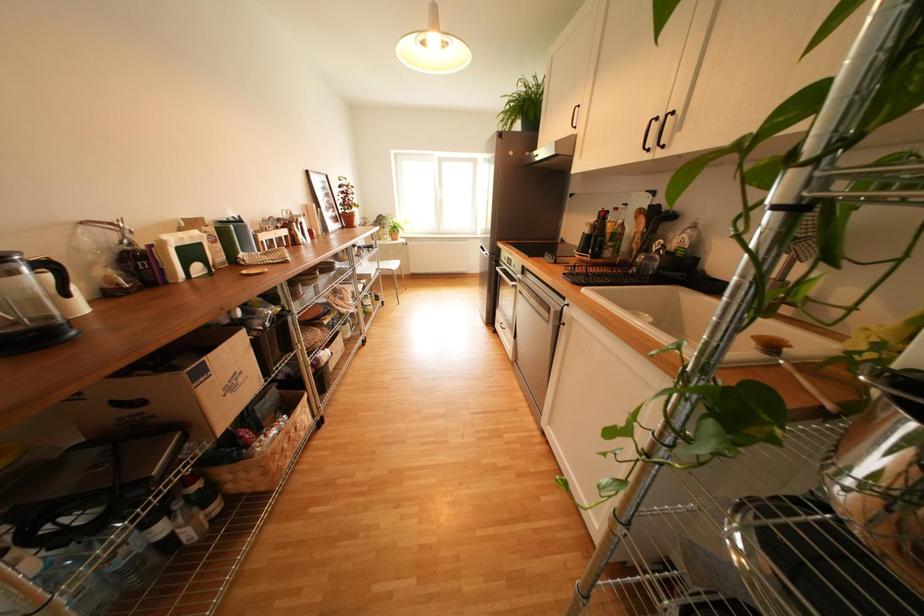
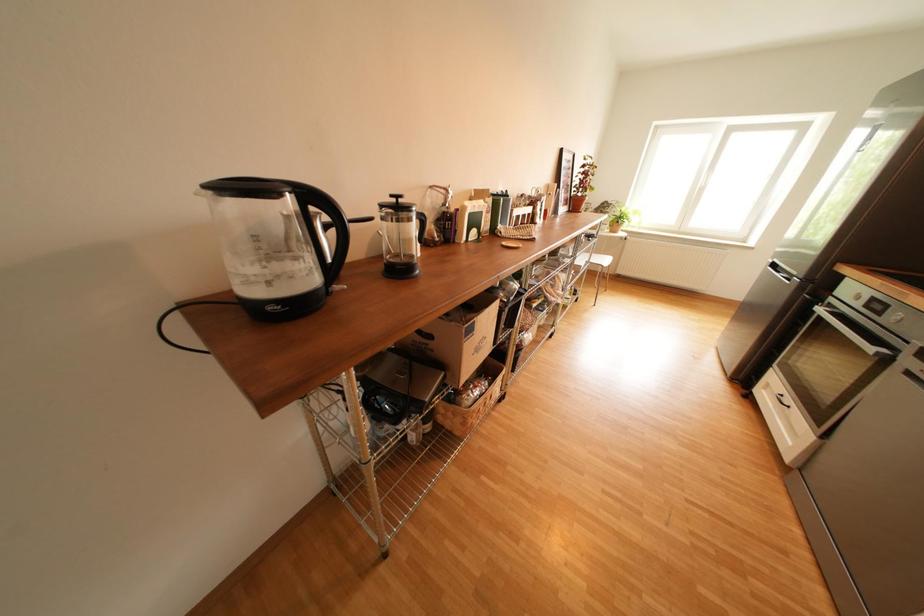
Question: Based on the continuous images, in which direction is the camera rotating? Reply with the corresponding letter.

Choices:
 (A) Left
 (B) Right
 (C) Up
 (D) Down

Answer: (A)